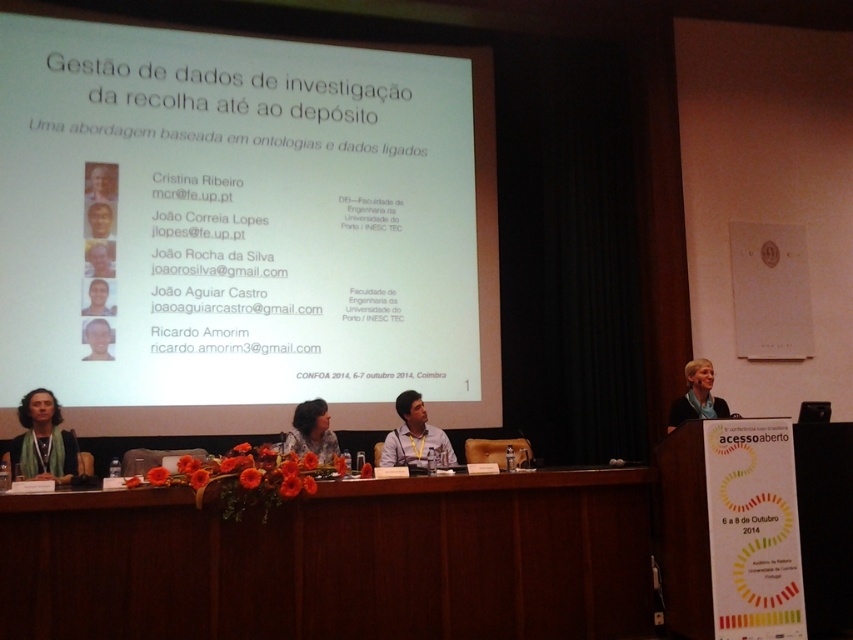
You are an attendee at the presentation and you want to take a photo of the slide. The white paper at center and light brown skin at center are blocking your view. Which object should you move to get a clearer view of the slide?

You should move the white paper at center since it has a greater height compared to light brown skin at center and is blocking your view more significantly.

You are attending a presentation and need to identify the speaker. You see a green scarf at lower left and a matte white shirt at lower right. Which one is closer to the bottom of the image?

The green scarf at lower left is closer to the bottom of the image because it is located below the matte white shirt at lower right.

You are a photographer standing at the back of the room. You want to take a photo of the white paper at center and the light brown skin at center so that both are in focus. The camera you are using has a depth of field that can cover 1.2 meters. Can you capture both objects in focus without adjusting your camera settings?

The white paper at center and light brown skin at center are 1.32 meters apart. Since the depth of field can only cover 1.2 meters, the distance between them exceeds the camera s capacity. Therefore, you cannot capture both in focus without adjusting your settings.